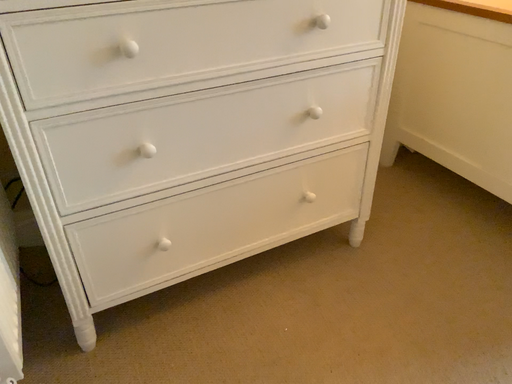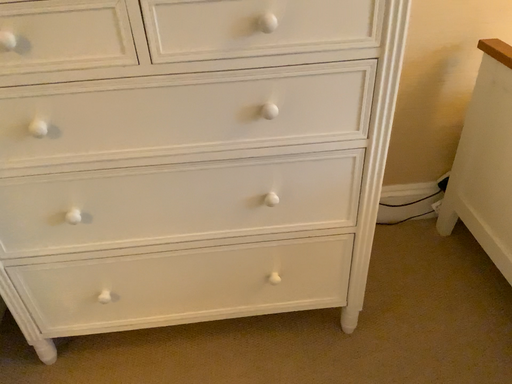
Question: Which way did the camera rotate in the video?

Choices:
 (A) rotated right
 (B) rotated left

Answer: (B)